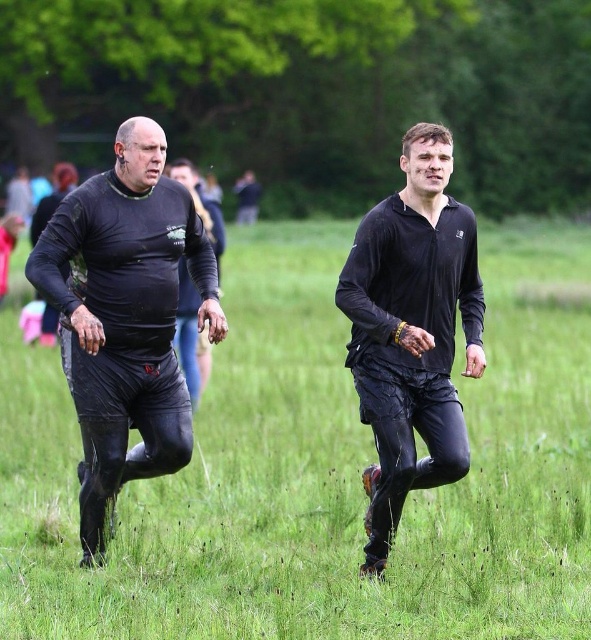
Question: Which point is closer to the camera taking this photo?

Choices:
 (A) (368, 282)
 (B) (167, 172)
 (C) (194, 237)

Answer: (A)

Question: Among these objects, which one is nearest to the camera?

Choices:
 (A) wet black pants at center
 (B) black matte clothing at left

Answer: (A)

Question: Which object is positioned closest to the matte black rugby ball at left?

Choices:
 (A) black matte jacket at center
 (B) wet black pants at center

Answer: (A)

Question: Is black matte clothing at left below black matte jacket at center?

Choices:
 (A) no
 (B) yes

Answer: (A)

Question: Is wet black pants at center further to camera compared to black matte jacket at center?

Choices:
 (A) no
 (B) yes

Answer: (A)

Question: Is wet black pants at center wider than matte black rugby ball at left?

Choices:
 (A) yes
 (B) no

Answer: (A)